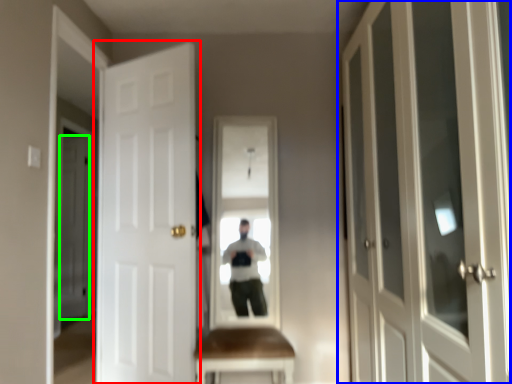
Question: Based on their relative distances, which object is nearer to door (highlighted by a red box)? Choose from door (highlighted by a blue box) and door (highlighted by a green box).

Choices:
 (A) door
 (B) door

Answer: (A)